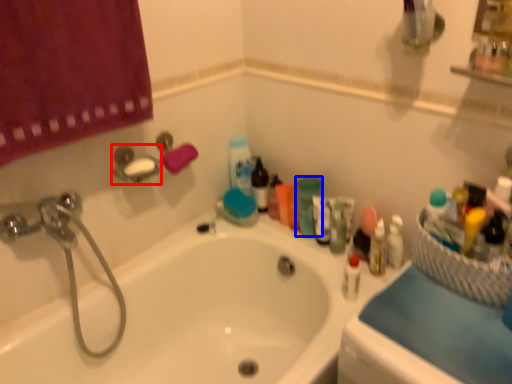
Question: Which point is further to the camera, towel bar (highlighted by a red box) or toiletry (highlighted by a blue box)?

Choices:
 (A) towel bar
 (B) toiletry

Answer: (B)